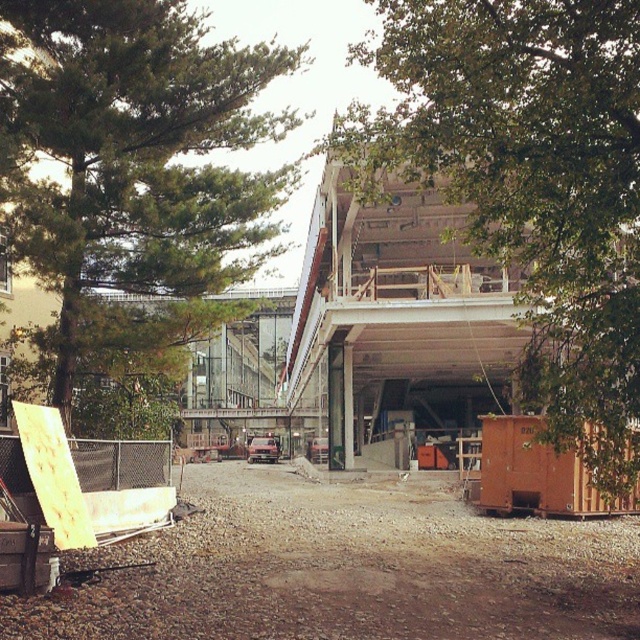
Which is behind, point (563, 384) or point (58, 193)?

The point (58, 193) is more distant.

From the picture: Does green leafy tree at upper right appear on the left side of green leafy tree at upper left?

Incorrect, green leafy tree at upper right is not on the left side of green leafy tree at upper left.

I want to click on green leafy tree at upper right, so click(x=529, y=186).